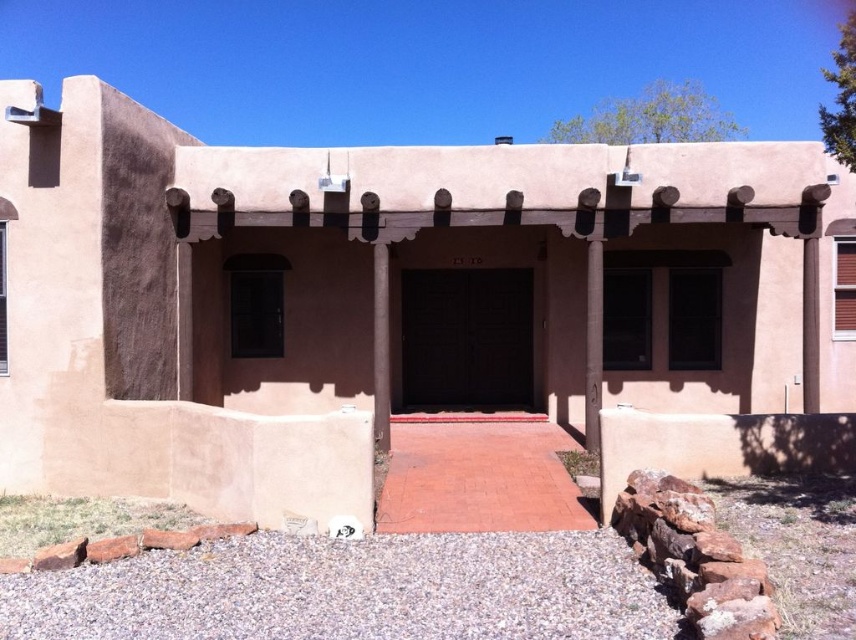
This screenshot has height=640, width=856. Find the location of `smooth concrete pillar at center`. smooth concrete pillar at center is located at coordinates (593, 342).

Is smooth concrete pillar at center smaller than brown wood pillar at center?

Actually, smooth concrete pillar at center might be larger than brown wood pillar at center.

Is point (592, 301) in front of point (385, 308)?

No, it is not.

Image resolution: width=856 pixels, height=640 pixels. I want to click on smooth concrete pillar at center, so click(x=593, y=342).